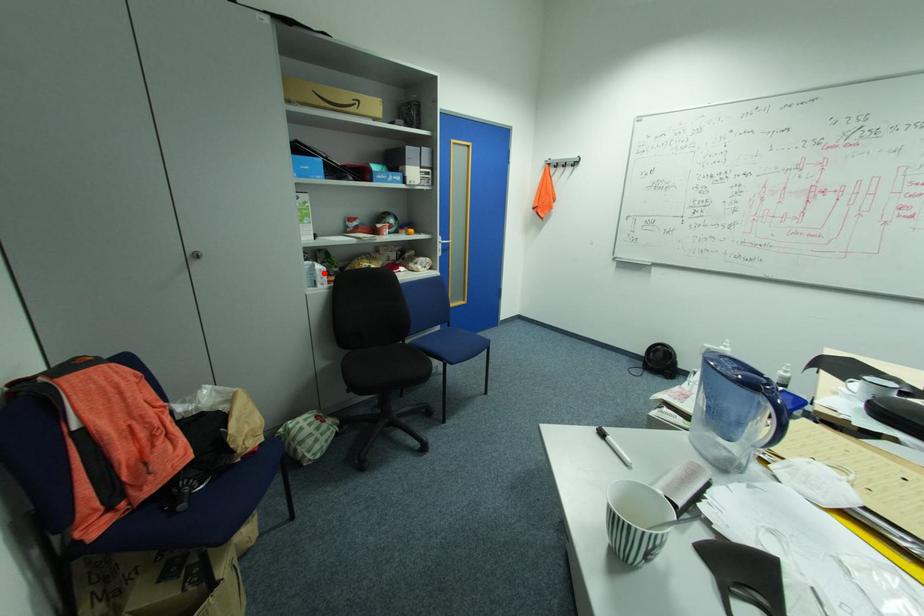
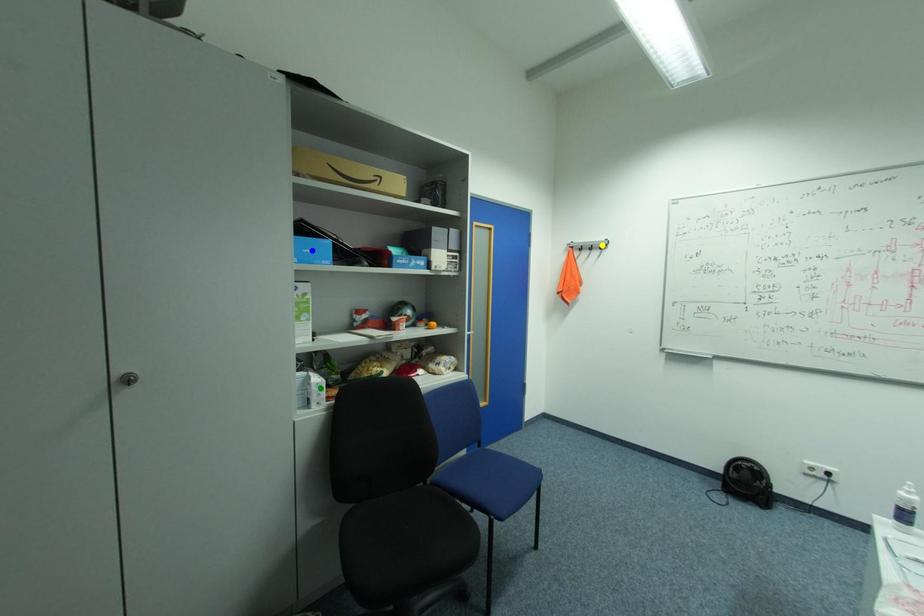
Question: I am providing you with two images of the same scene from different viewpoints. A red point is marked on the first image. You are given multiple points on the second image. Which point in image 2 represents the same 3d spot as the red point in image 1?

Choices:
 (A) green point
 (B) yellow point
 (C) blue point

Answer: (A)